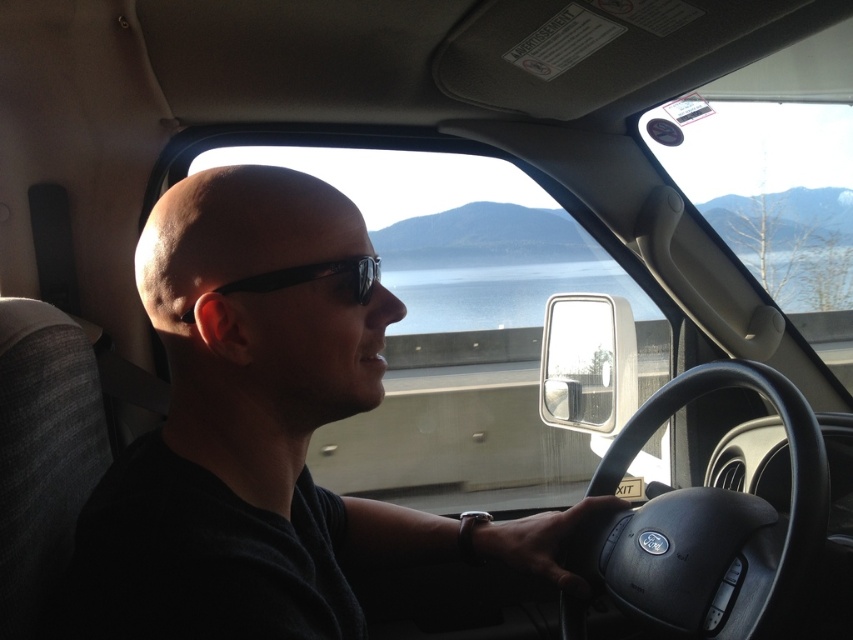
You are a passenger in the car and want to know if the black matte steering wheel at center is wider than the black plastic sunglasses at center. Can you confirm this?

The black matte steering wheel at center is wider than the black plastic sunglasses at center according to the description.

In the scene shown: You are sitting in the passenger seat of the car and notice the black matte shirt at center and the black matte steering wheel at center. Which object is positioned more to the left from your viewpoint?

The black matte shirt at center is positioned to the left of the black matte steering wheel at center, so it is more to the left from your viewpoint.